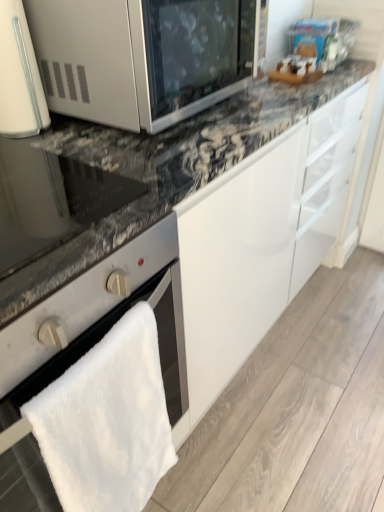
Question: From the image's perspective, would you say matte black oven at left is shown under satin silver oven at lower left?

Choices:
 (A) no
 (B) yes

Answer: (A)

Question: Does matte black oven at left have a lesser height compared to satin silver oven at lower left?

Choices:
 (A) yes
 (B) no

Answer: (A)

Question: Is the position of matte black oven at left less distant than that of satin silver oven at lower left?

Choices:
 (A) no
 (B) yes

Answer: (A)

Question: Does matte black oven at left have a lesser width compared to satin silver oven at lower left?

Choices:
 (A) yes
 (B) no

Answer: (A)

Question: From a real-world perspective, does matte black oven at left stand above satin silver oven at lower left?

Choices:
 (A) yes
 (B) no

Answer: (A)

Question: From the image's perspective, does matte black oven at left appear higher than satin silver oven at lower left?

Choices:
 (A) no
 (B) yes

Answer: (B)

Question: Considering the relative sizes of white glossy microwave at upper left and satin silver microwave at upper left in the image provided, is white glossy microwave at upper left taller than satin silver microwave at upper left?

Choices:
 (A) no
 (B) yes

Answer: (B)

Question: Does white glossy microwave at upper left lie in front of satin silver microwave at upper left?

Choices:
 (A) no
 (B) yes

Answer: (A)

Question: Is white glossy microwave at upper left positioned behind satin silver microwave at upper left?

Choices:
 (A) no
 (B) yes

Answer: (B)

Question: Considering the relative sizes of white glossy microwave at upper left and satin silver microwave at upper left in the image provided, is white glossy microwave at upper left shorter than satin silver microwave at upper left?

Choices:
 (A) yes
 (B) no

Answer: (B)

Question: Does white glossy microwave at upper left contain satin silver microwave at upper left?

Choices:
 (A) yes
 (B) no

Answer: (B)

Question: From a real-world perspective, is white glossy microwave at upper left on satin silver microwave at upper left?

Choices:
 (A) yes
 (B) no

Answer: (A)

Question: Does matte black oven at left have a greater height compared to satin silver microwave at upper left?

Choices:
 (A) yes
 (B) no

Answer: (B)